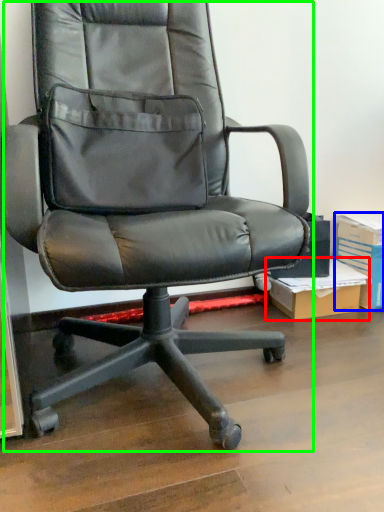
Question: Which object is positioned farthest from cardboard box (highlighted by a red box)? Select from paperback book (highlighted by a blue box) and chair (highlighted by a green box).

Choices:
 (A) paperback book
 (B) chair

Answer: (B)